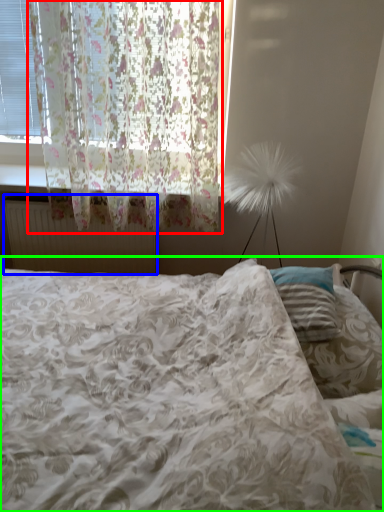
Question: Considering the real-world distances, which object is closest to curtain (highlighted by a red box)? radiator (highlighted by a blue box) or bed (highlighted by a green box).

Choices:
 (A) radiator
 (B) bed

Answer: (A)